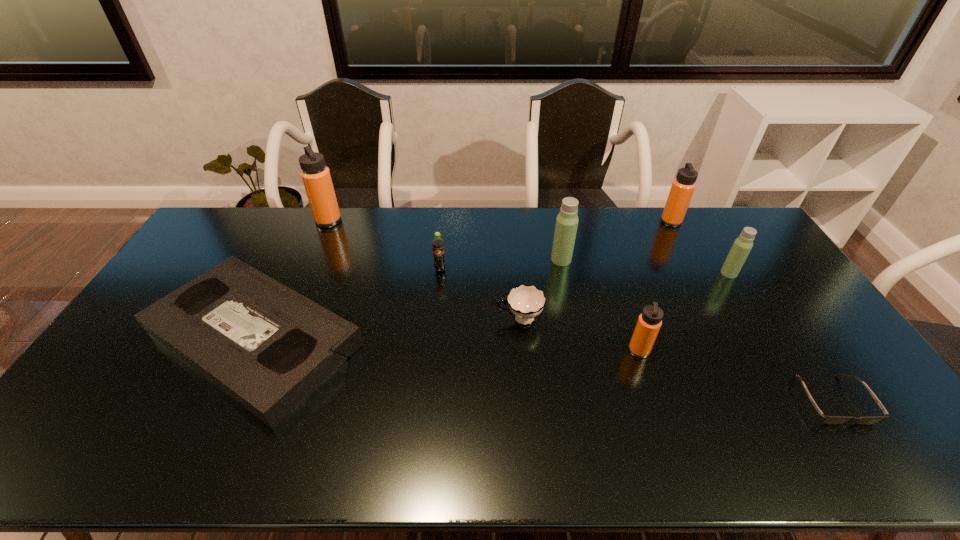
I want to click on the tallest object, so click(315, 175).

Where is `the tallest thermos bottle`? the tallest thermos bottle is located at coordinates (315, 175).

The width and height of the screenshot is (960, 540). I want to click on the second smallest orange thermos bottle, so pyautogui.click(x=683, y=186).

You are a GUI agent. You are given a task and a screenshot of the screen. Output one action in this format:
    pyautogui.click(x=<x>, y=<y>)
    Task: Click on the rightmost orange thermos bottle
    Image resolution: width=960 pixels, height=540 pixels.
    Given the screenshot: What is the action you would take?
    pyautogui.click(x=683, y=186)

What are the coordinates of `the fourth thermos bottle from right to left` in the screenshot? It's located at (567, 220).

Where is `the fifth object from left to right`? The image size is (960, 540). the fifth object from left to right is located at coordinates coord(567,220).

The height and width of the screenshot is (540, 960). I want to click on the right light thermos bottle, so click(x=742, y=246).

Identify the location of the rightmost thermos bottle. Image resolution: width=960 pixels, height=540 pixels. (742, 246).

This screenshot has height=540, width=960. Identify the location of the nearest orange thermos bottle. (649, 322).

In order to click on the second orange thermos bottle from right to left in this screenshot , I will do `click(649, 322)`.